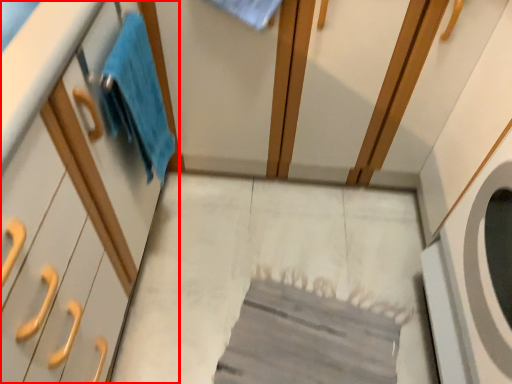
Question: Where is cabinetry (annotated by the red box) located in relation to bath towel in the image?

Choices:
 (A) right
 (B) left

Answer: (B)